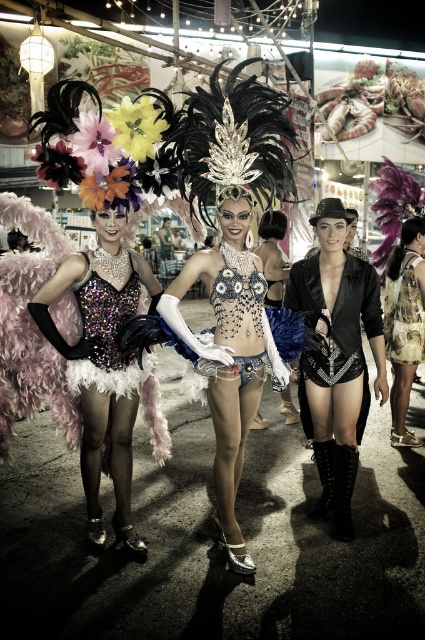
You are a photographer at the event and want to capture the sparkly sequin dress at center and the fur vest at center in a single frame. Which object should you focus on to ensure both are visible without cropping?

The sparkly sequin dress at center is bigger than the fur vest at center, so focusing on the sparkly sequin dress at center will ensure both are visible without cropping.